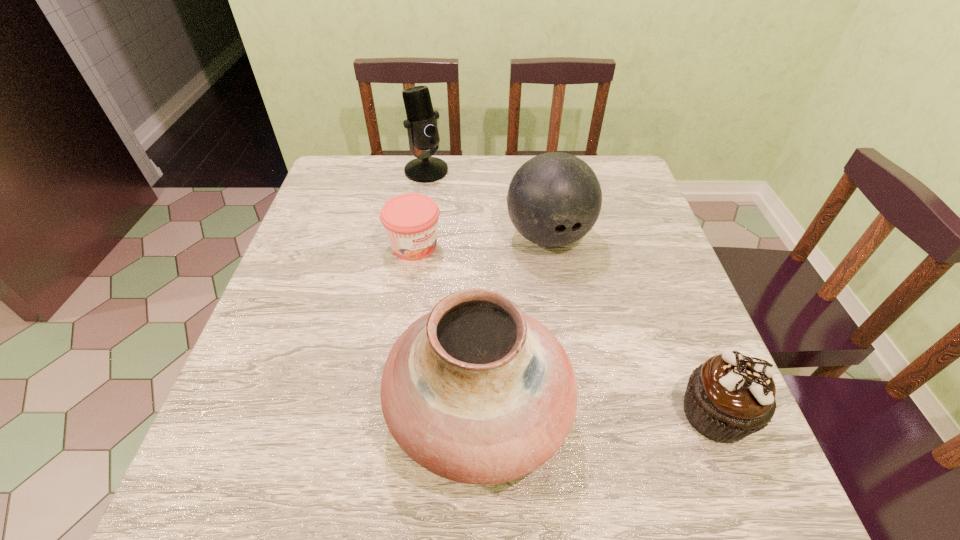
Identify the location of pottery. Image resolution: width=960 pixels, height=540 pixels. (476, 391).

What are the coordinates of `the rightmost object` in the screenshot? It's located at (730, 396).

What are the coordinates of `cupcake` in the screenshot? It's located at (730, 396).

Identify the location of jam. (410, 220).

Identify the location of the farthest object. (421, 124).

Locate an element on the screen. This screenshot has width=960, height=540. bowling ball is located at coordinates (554, 199).

The height and width of the screenshot is (540, 960). I want to click on blank space located on the back of the pottery, so click(x=479, y=305).

In order to click on free space located on the back of the rightmost object in this screenshot , I will do `click(647, 240)`.

Image resolution: width=960 pixels, height=540 pixels. I want to click on free space located on the front label of the jam, so click(x=472, y=295).

The width and height of the screenshot is (960, 540). Find the location of `vacant space located 0.320m on the front label of the jam`. vacant space located 0.320m on the front label of the jam is located at coordinates (528, 342).